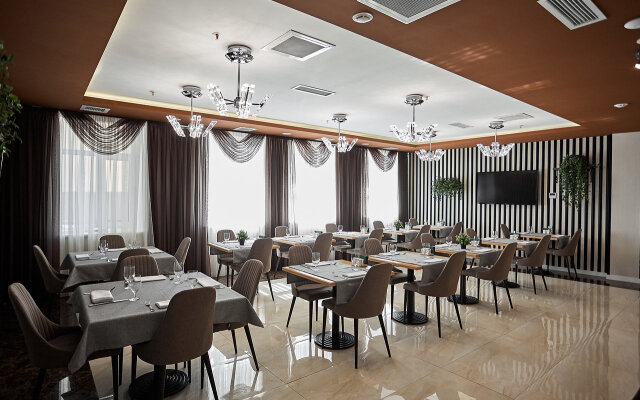
The width and height of the screenshot is (640, 400). What are the coordinates of `table bases` in the screenshot? It's located at (168, 384), (340, 338), (418, 315), (468, 297), (509, 281).